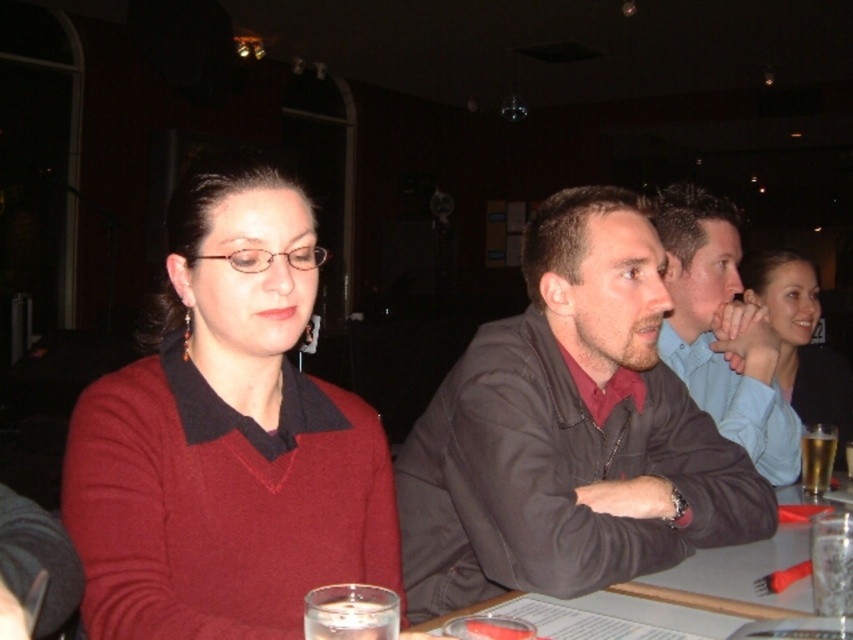
Question: In this image, where is matte red sweater at left located relative to smooth brown shirt at center?

Choices:
 (A) above
 (B) below

Answer: (B)

Question: Which of the following is the farthest from the observer?

Choices:
 (A) (807, 470)
 (B) (770, 301)
 (C) (773, 499)
 (D) (741, 566)

Answer: (B)

Question: Among these points, which one is nearest to the camera?

Choices:
 (A) (675, 602)
 (B) (485, 365)
 (C) (376, 625)

Answer: (C)

Question: Can you confirm if dark brown leather jacket at center is bigger than clear glass at table right?

Choices:
 (A) no
 (B) yes

Answer: (B)

Question: Can you confirm if smooth wooden table at center is positioned to the left of clear liquid glass at lower center?

Choices:
 (A) no
 (B) yes

Answer: (A)

Question: Which of these objects is positioned farthest from the dark brown leather jacket at center?

Choices:
 (A) smooth brown shirt at center
 (B) matte black sweater at center
 (C) clear glass beer at lower right

Answer: (B)